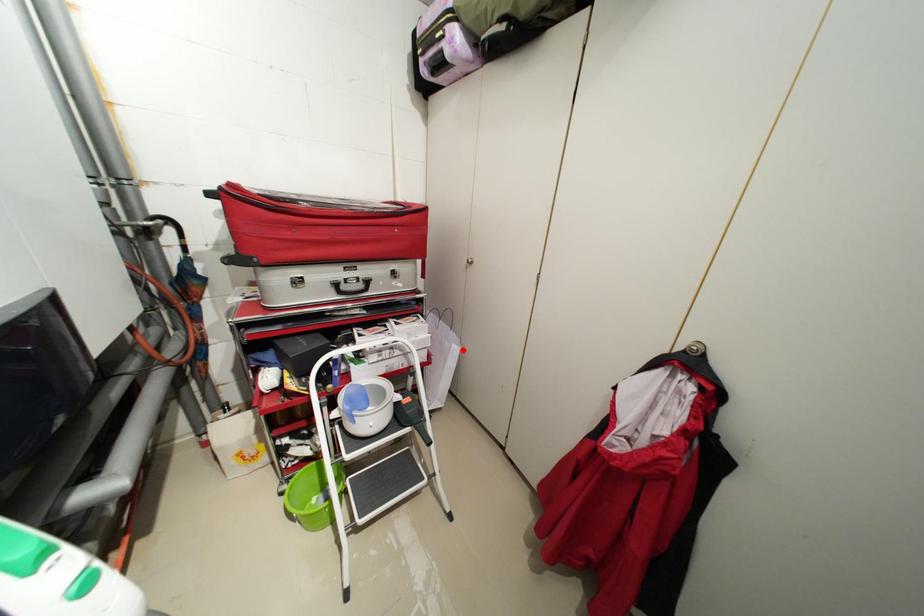
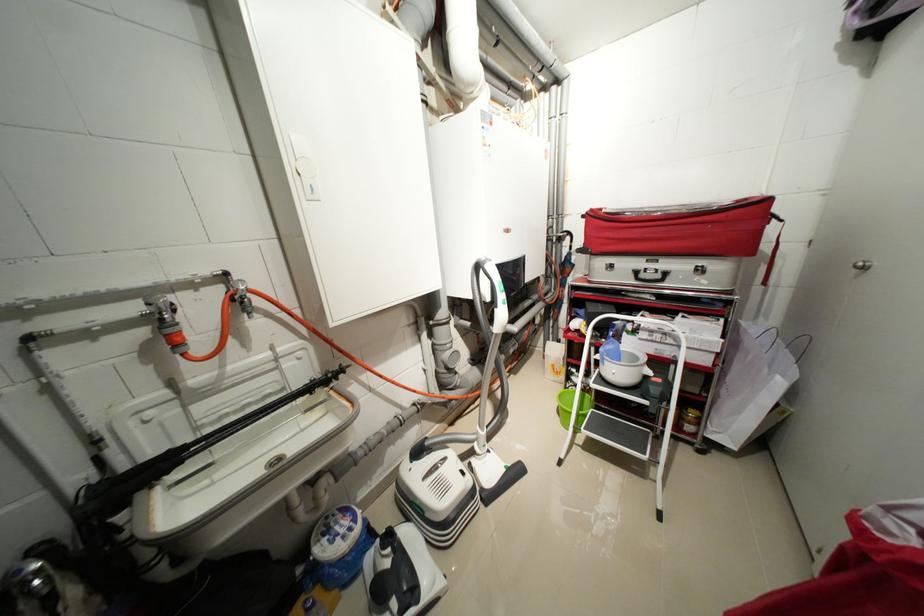
In the second image, find the point that corresponds to the highlighted location in the first image.

(787, 384)